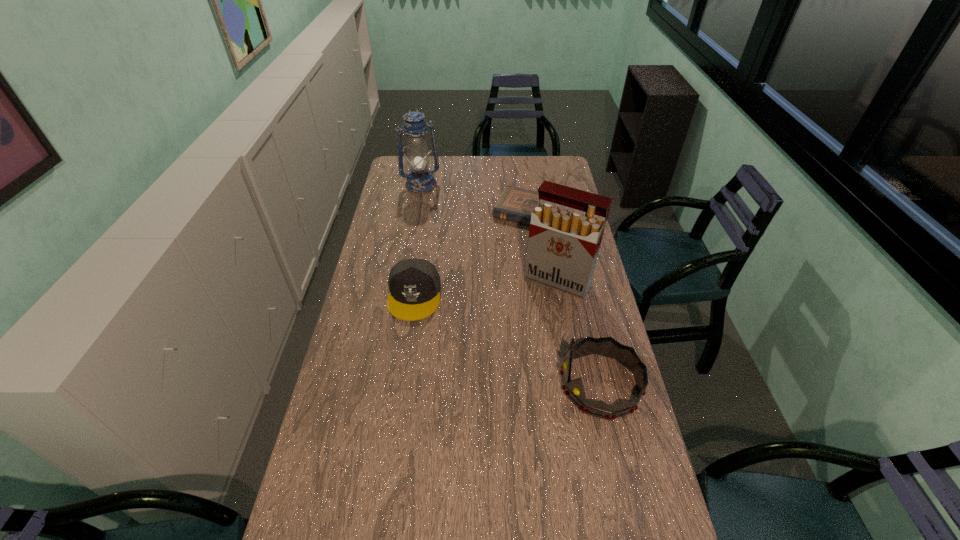
In order to click on free spot between the farthest object and the second shortest object in this screenshot , I will do `click(418, 240)`.

Find the location of a particular element. This screenshot has width=960, height=540. object that stands as the closest to the cigarette case is located at coordinates (515, 204).

I want to click on the fourth closest object to the lantern, so click(574, 390).

Identify the location of vacant space that satisfies the following two spatial constraints: 1. on the front side of the cigarette case; 2. on the left side of the shortest object. (542, 281).

In order to click on blank space that satisfies the following two spatial constraints: 1. on the front side of the cigarette case; 2. at the front of the tiara with jewels in this screenshot , I will do `click(578, 384)`.

The width and height of the screenshot is (960, 540). Identify the location of vacant point that satisfies the following two spatial constraints: 1. on the front side of the Bible; 2. on the right side of the cigarette case. (542, 281).